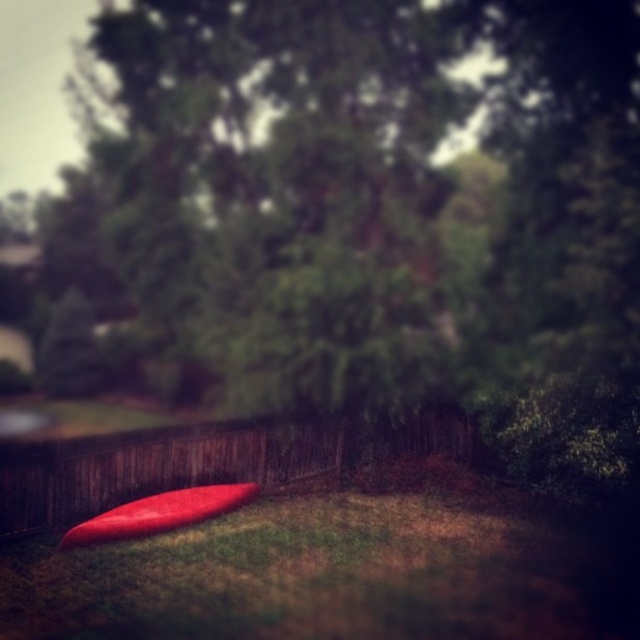
Looking at this image, you are a gardener trying to reach the glossy red surfboard at center to clean it. The wooden fence at lower left is in your way. Can you move the fence to access the surfboard?

The wooden fence at lower left is positioned over the glossy red surfboard at center, meaning the fence is blocking direct access to the surfboard. Since fences are typically fixed structures, you cannot move it easily. You might need to go around the fence to reach the surfboard.

You are a painter who wants to paint the wooden fence at lower left and the glossy red surfboard at center. If you use the same amount of paint for both, which object will require more paint due to its size?

The wooden fence at lower left requires more paint because it is larger in size than the glossy red surfboard at center.